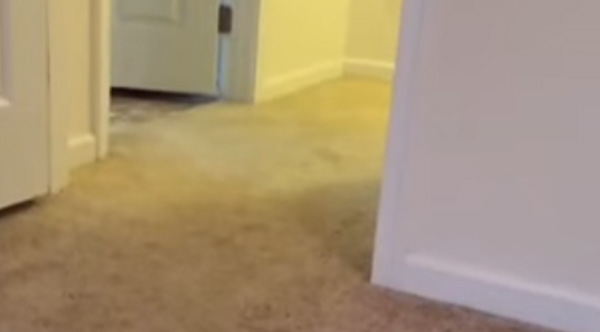
Image resolution: width=600 pixels, height=332 pixels. I want to click on baseboards, so click(x=305, y=83), click(x=377, y=70).